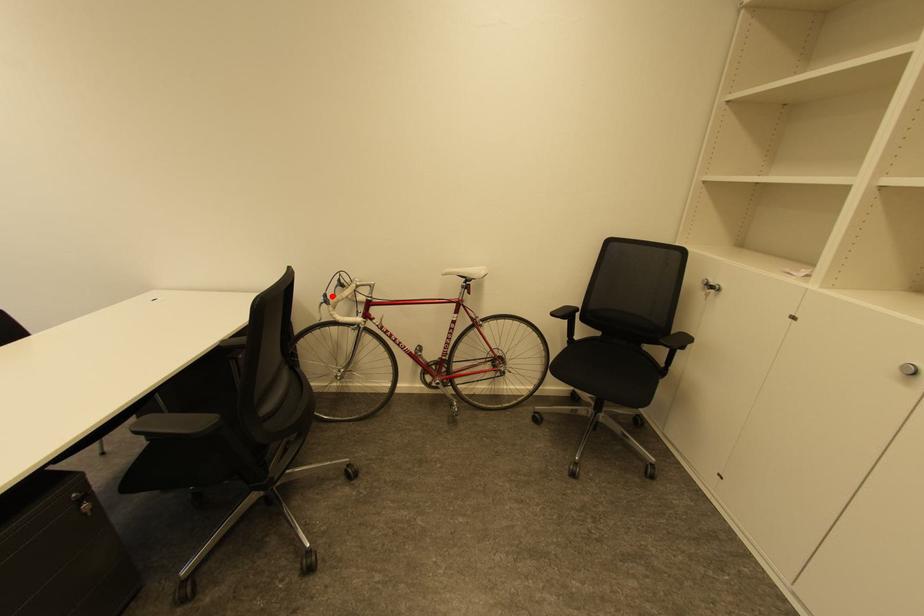
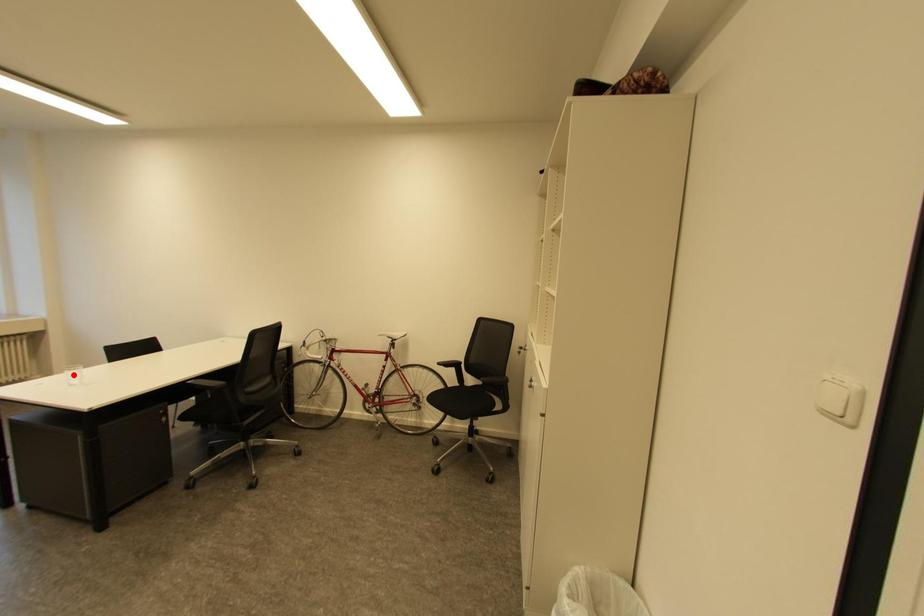
I am providing you with two images of the same scene from different viewpoints. A red point is marked on the first image and another point is marked on the second image. Does the point marked in image1 correspond to the same location as the one in image2?

No